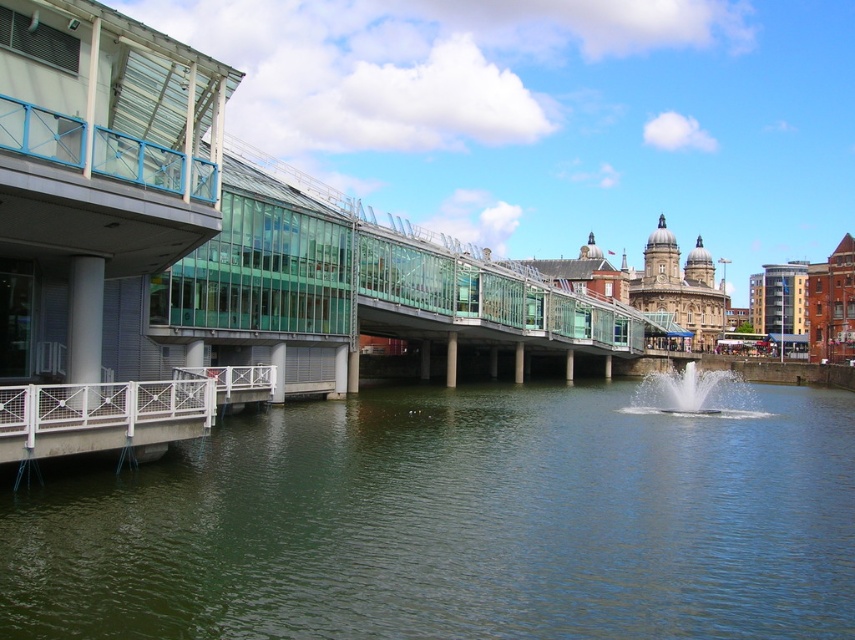
Does transparent glass bridge at center have a greater width compared to white frothy water at center?

Indeed, transparent glass bridge at center has a greater width compared to white frothy water at center.

Which is above, transparent glass bridge at center or white frothy water at center?

transparent glass bridge at center is above.

Is point (455, 337) positioned after point (647, 403)?

Yes, point (455, 337) is behind point (647, 403).

You are a GUI agent. You are given a task and a screenshot of the screen. Output one action in this format:
    pyautogui.click(x=<x>, y=<y>)
    Task: Click on the transparent glass bridge at center
    The image size is (855, 640).
    Given the screenshot: What is the action you would take?
    pyautogui.click(x=364, y=282)

Who is higher up, greenish water at center or white frothy water at center?

white frothy water at center is above.

Where is `greenish water at center`? The width and height of the screenshot is (855, 640). greenish water at center is located at coordinates (455, 524).

Which is behind, point (142, 625) or point (559, 342)?

The point (559, 342) is more distant.

Is point (404, 593) in front of point (576, 324)?

Yes, point (404, 593) is closer to viewer.

The image size is (855, 640). I want to click on greenish water at center, so click(455, 524).

Identify the location of greenish water at center. This screenshot has height=640, width=855. (455, 524).